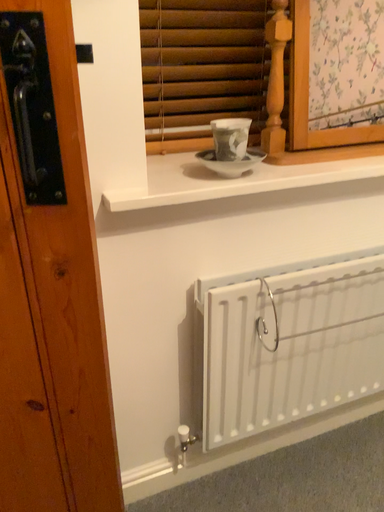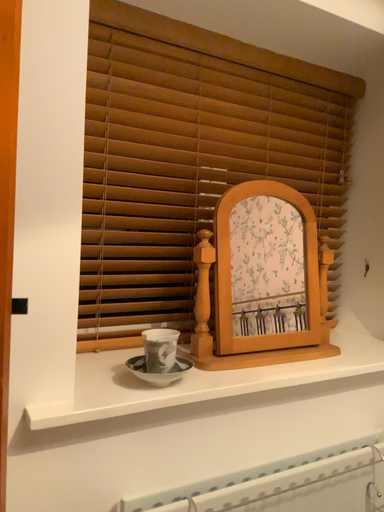
Question: How did the camera likely rotate when shooting the video?

Choices:
 (A) rotated left
 (B) rotated right

Answer: (B)